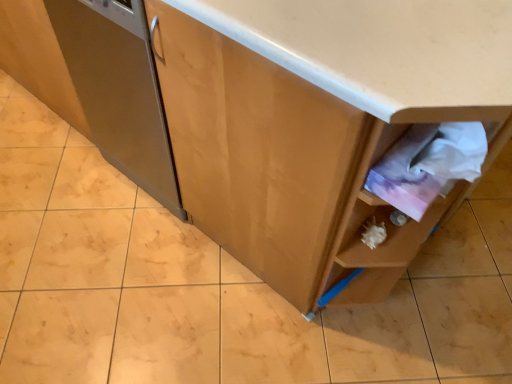
Find the location of `matte wood cabinet at left`. matte wood cabinet at left is located at coordinates (96, 81).

Image resolution: width=512 pixels, height=384 pixels. What do you see at coordinates (96, 81) in the screenshot?
I see `matte wood cabinet at left` at bounding box center [96, 81].

Find the location of a particular element. matte wood cabinet at left is located at coordinates (96, 81).